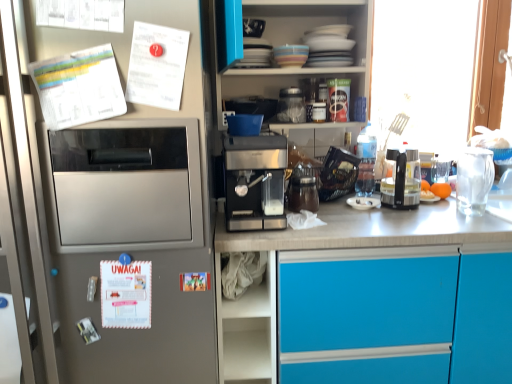
You are a GUI agent. You are given a task and a screenshot of the screen. Output one action in this format:
    pyautogui.click(x=<x>, y=<y>)
    Task: Click on the vacant point to the right of black plastic coffee machine at center
    Image resolution: width=512 pixels, height=384 pixels.
    Given the screenshot: What is the action you would take?
    pyautogui.click(x=443, y=208)